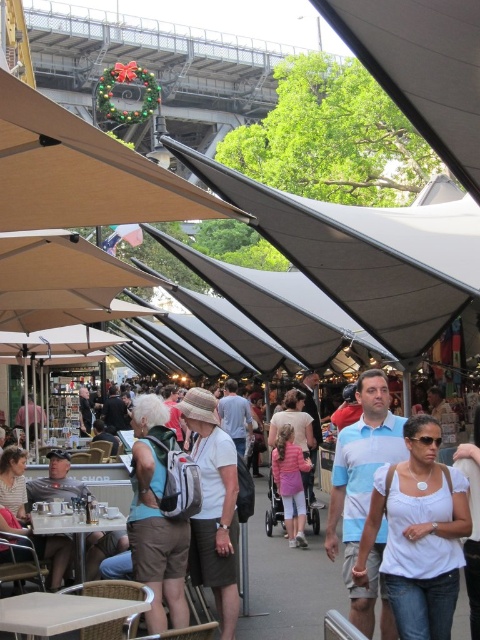
Looking at this image, you are standing at the market and want to know how far the point at coordinates [421,230] is from your current position. Can you determine the distance?

The point at coordinates [421,230] is 44.48 meters away from the camera, so the distance from your current position would be approximately 44.48 meters.

You are standing at the entrance of the market and notice two points marked in the scene. Which point is closer to you, point (443, 212) or point (452, 8)?

Point (443, 212) is closer to you because it is further to the viewer than point (452, 8).

You are a photographer trying to capture a clear shot of the white matte shirt at center and the gray fabric canopy at center. However, you notice an obstruction. Which object is blocking the view of the other?

The gray fabric canopy at center is blocking the view of the white matte shirt at center because the white matte shirt at center is behind the gray fabric canopy at center.